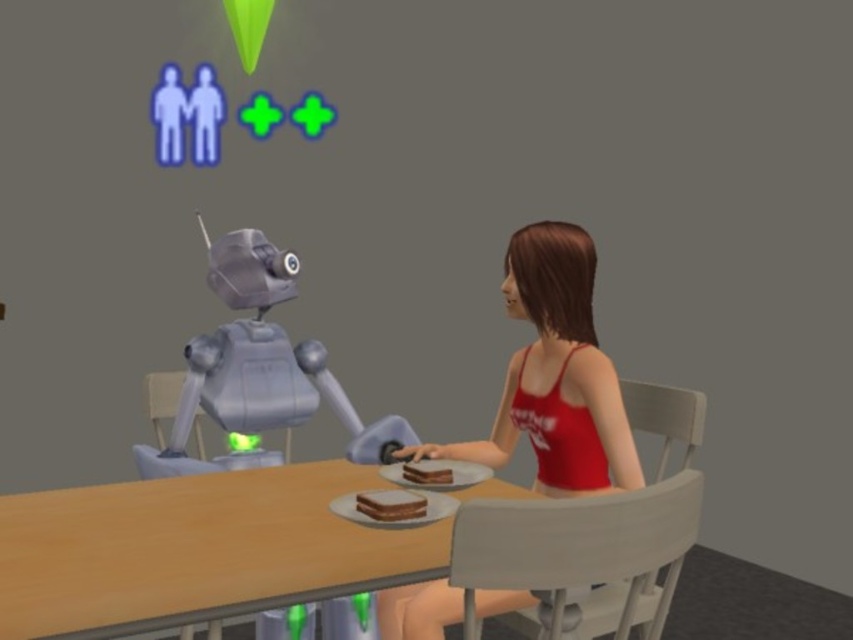
You are a Sim character who wants to place a chocolate cake at center on the wooden table at center. Can you do that based on their positions?

The wooden table at center is positioned on the left side of chocolate cake at center, so the chocolate cake at center is already placed on the wooden table at center.

You are a character in The Sims who wants to sit down. You are standing near the white plastic chair at lower right and the wooden chair at center. Which chair has a wider seat?

The white plastic chair at lower right is wider than the wooden chair at center according to the description.

You are a character in The Sims game trying to sit down. You see a white plastic chair at lower right and a wooden chair at center. Which chair is closer to you?

The white plastic chair at lower right is closer because it is in front of the wooden chair at center.